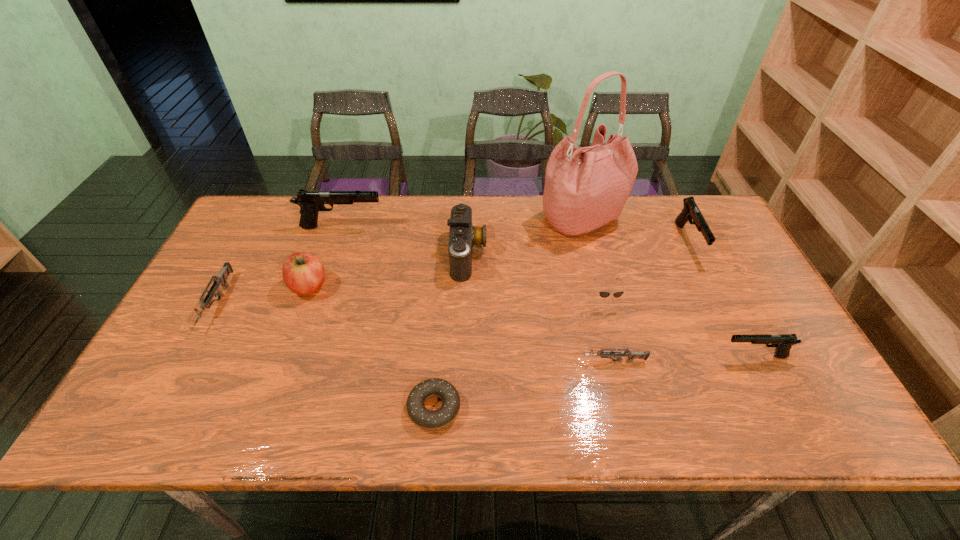
Locate an element on the screen. vacant space situated 0.340m at the aiming end of the nearest black gun is located at coordinates (582, 356).

Locate an element on the screen. The width and height of the screenshot is (960, 540). free space located 0.050m at the aiming end of the nearest black gun is located at coordinates (701, 356).

Locate an element on the screen. free location located at the aiming end of the nearest black gun is located at coordinates (574, 356).

The image size is (960, 540). I want to click on vacant space located in front of the lenses of the black sunglasses, so [612, 328].

Image resolution: width=960 pixels, height=540 pixels. Identify the location of free point located aimed along the barrel of the left grey gun. (159, 411).

At what (x,y) coordinates should I click in order to perform the action: click on vacant space situated aimed along the barrel of the right grey gun. Please return your answer as a coordinate pair (x, y). Looking at the image, I should click on (488, 361).

Find the location of a particular element. vacant area located 0.400m aimed along the barrel of the right grey gun is located at coordinates (414, 361).

Locate an element on the screen. The width and height of the screenshot is (960, 540). vacant space located aimed along the barrel of the right grey gun is located at coordinates [455, 361].

Where is `vacant space located on the right of the brown doughnut`? This screenshot has height=540, width=960. vacant space located on the right of the brown doughnut is located at coordinates (483, 408).

Identify the location of handbag that is at the far edge. This screenshot has height=540, width=960. (585, 188).